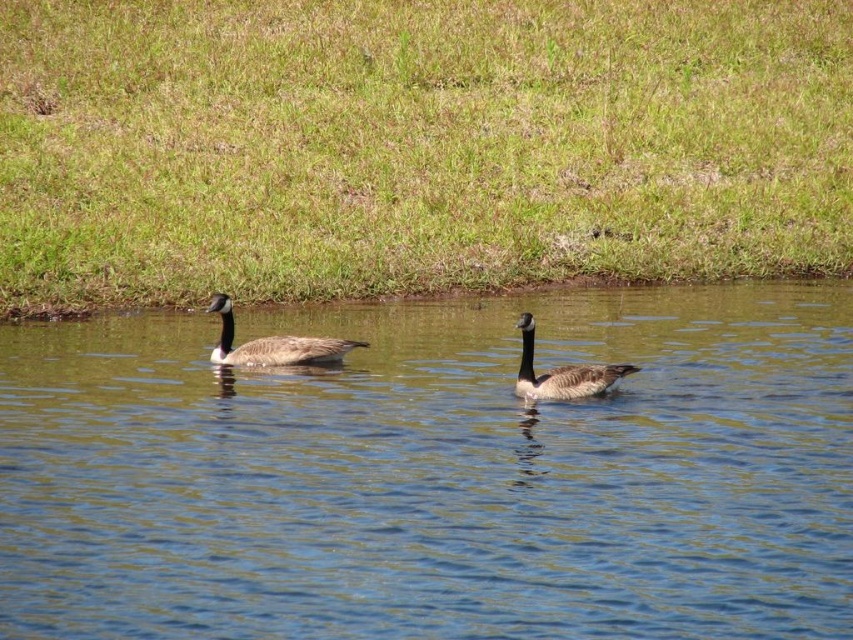
You are a photographer standing at the edge of the pond. You want to take a photo of the clear blue water at center and the dark gray feathers at center. Which object will appear larger in your photo?

The clear blue water at center will appear larger in the photo because it is closer to the viewer than the dark gray feathers at center.

You are a photographer trying to capture the Canada geese in the scene. You notice the clear blue water at center and the dark gray feathers at center. Which object would require you to adjust your camera focus to a wider angle to include both in the frame?

The clear blue water at center is bigger than the dark gray feathers at center, so you would need to adjust your camera focus to a wider angle to include both the larger clear blue water at center and the smaller dark gray feathers at center in the frame.